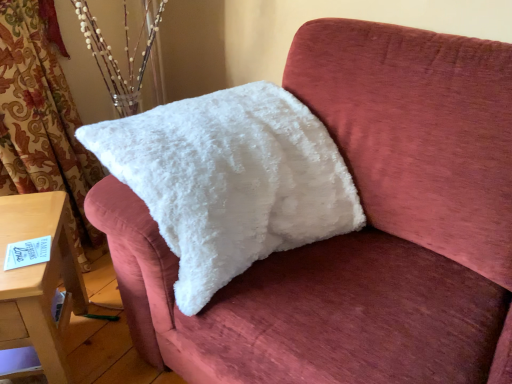
Question: Is white fluffy pillow at upper left not within wooden table at lower left?

Choices:
 (A) no
 (B) yes

Answer: (B)

Question: Does white fluffy pillow at upper left have a larger size compared to wooden table at lower left?

Choices:
 (A) yes
 (B) no

Answer: (A)

Question: Is white fluffy pillow at upper left at the right side of wooden table at lower left?

Choices:
 (A) yes
 (B) no

Answer: (A)

Question: Considering the relative positions of white fluffy pillow at upper left and wooden table at lower left in the image provided, is white fluffy pillow at upper left to the left of wooden table at lower left from the viewer's perspective?

Choices:
 (A) no
 (B) yes

Answer: (A)

Question: From a real-world perspective, is white fluffy pillow at upper left beneath wooden table at lower left?

Choices:
 (A) no
 (B) yes

Answer: (A)

Question: From the image's perspective, is white fluffy pillow at upper left under wooden table at lower left?

Choices:
 (A) no
 (B) yes

Answer: (A)

Question: Can you confirm if wooden table at lower left is taller than white fluffy pillow at upper left?

Choices:
 (A) no
 (B) yes

Answer: (A)

Question: From the image's perspective, is wooden table at lower left located beneath white fluffy pillow at upper left?

Choices:
 (A) yes
 (B) no

Answer: (A)

Question: Is wooden table at lower left turned away from white fluffy pillow at upper left?

Choices:
 (A) no
 (B) yes

Answer: (A)

Question: Can you confirm if wooden table at lower left is shorter than white fluffy pillow at upper left?

Choices:
 (A) no
 (B) yes

Answer: (B)

Question: From a real-world perspective, is wooden table at lower left located higher than white fluffy pillow at upper left?

Choices:
 (A) no
 (B) yes

Answer: (A)

Question: Can you confirm if wooden table at lower left is bigger than white fluffy pillow at upper left?

Choices:
 (A) no
 (B) yes

Answer: (A)

Question: Considering the positions of point (29, 337) and point (200, 286), is point (29, 337) closer or farther from the camera than point (200, 286)?

Choices:
 (A) farther
 (B) closer

Answer: (A)